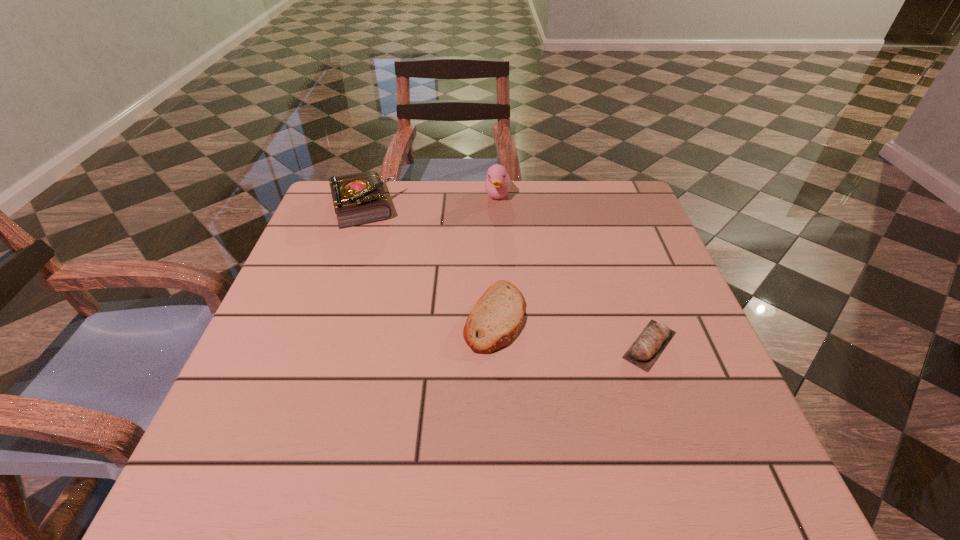
In order to click on duckling in this screenshot , I will do [497, 185].

The height and width of the screenshot is (540, 960). What are the coordinates of `the second tallest object` in the screenshot? It's located at pyautogui.click(x=359, y=198).

Find the location of a particular element. The image size is (960, 540). the leftmost object is located at coordinates (359, 198).

This screenshot has width=960, height=540. Identify the location of the left pita bread. (496, 318).

The height and width of the screenshot is (540, 960). Identify the location of the right pita bread. (648, 346).

Where is `blank space located on the front-facing side of the duckling`? The width and height of the screenshot is (960, 540). blank space located on the front-facing side of the duckling is located at coordinates (503, 291).

You are a GUI agent. You are given a task and a screenshot of the screen. Output one action in this format:
    pyautogui.click(x=<x>, y=<y>)
    Task: Click on the free point located 0.210m on the right of the diary
    This screenshot has height=540, width=960.
    Given the screenshot: What is the action you would take?
    pyautogui.click(x=476, y=206)

I want to click on vacant space located 0.070m on the right of the left pita bread, so click(560, 317).

Find the location of `vacant space located 0.200m on the front of the rightmost object`. vacant space located 0.200m on the front of the rightmost object is located at coordinates (700, 487).

Where is `duckling situated at the far edge`? duckling situated at the far edge is located at coordinates (497, 185).